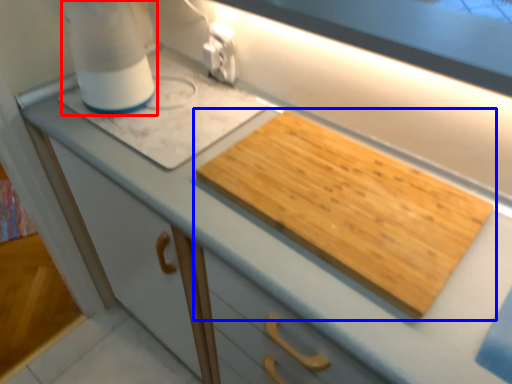
Question: Which of the following is the closest to the observer, blender (highlighted by a red box) or cutting board (highlighted by a blue box)?

Choices:
 (A) blender
 (B) cutting board

Answer: (B)